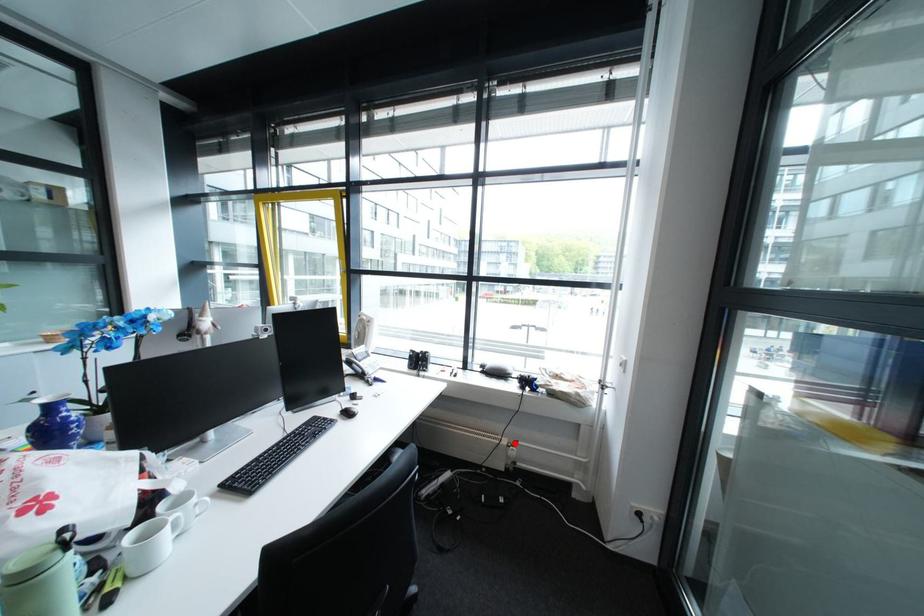
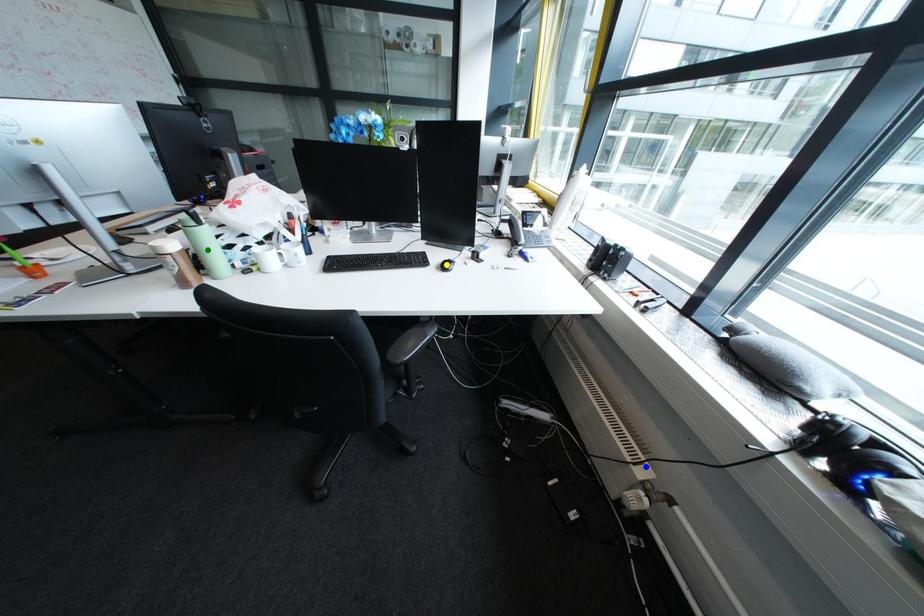
Question: I am providing you with two images of the same scene from different viewpoints. A red point is marked on the first image. You are given multiple points on the second image. Can you choose the point in image 2 that corresponds to the point in image 1?

Choices:
 (A) yellow point
 (B) green point
 (C) blue point

Answer: (C)